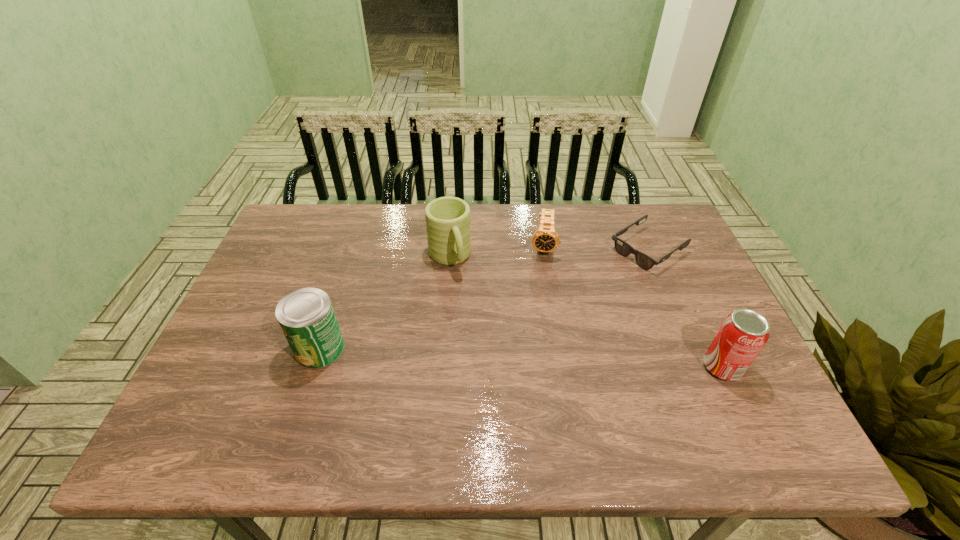
Identify the location of object present at the near edge. (742, 335).

Identify the location of soda can present at the right edge. This screenshot has width=960, height=540. (742, 335).

This screenshot has width=960, height=540. Identify the location of sunglasses present at the right edge. (623, 248).

This screenshot has height=540, width=960. I want to click on object located at the far right corner, so click(x=623, y=248).

Identify the location of object positioned at the near right corner. (742, 335).

Find the location of a particular element. This screenshot has width=960, height=540. free space at the far edge is located at coordinates (483, 249).

Image resolution: width=960 pixels, height=540 pixels. I want to click on vacant region at the near edge of the desktop, so click(538, 396).

The image size is (960, 540). In the image, there is a desktop. What are the coordinates of `vacant space at the left edge` in the screenshot? It's located at (268, 281).

Identify the location of vacant area at the right edge. Image resolution: width=960 pixels, height=540 pixels. (683, 252).

In the image, there is a desktop. Identify the location of vacant space at the far left corner. The width and height of the screenshot is (960, 540). (309, 241).